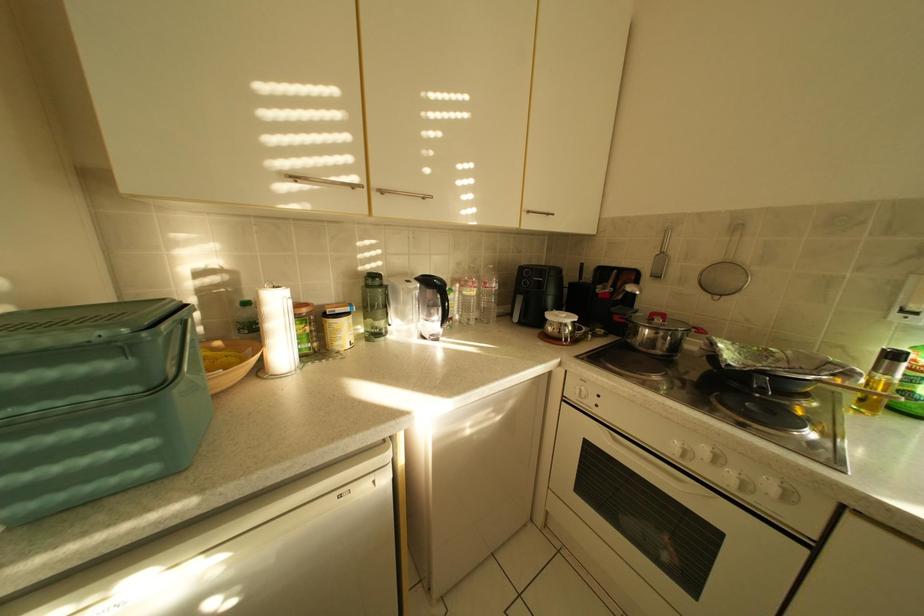
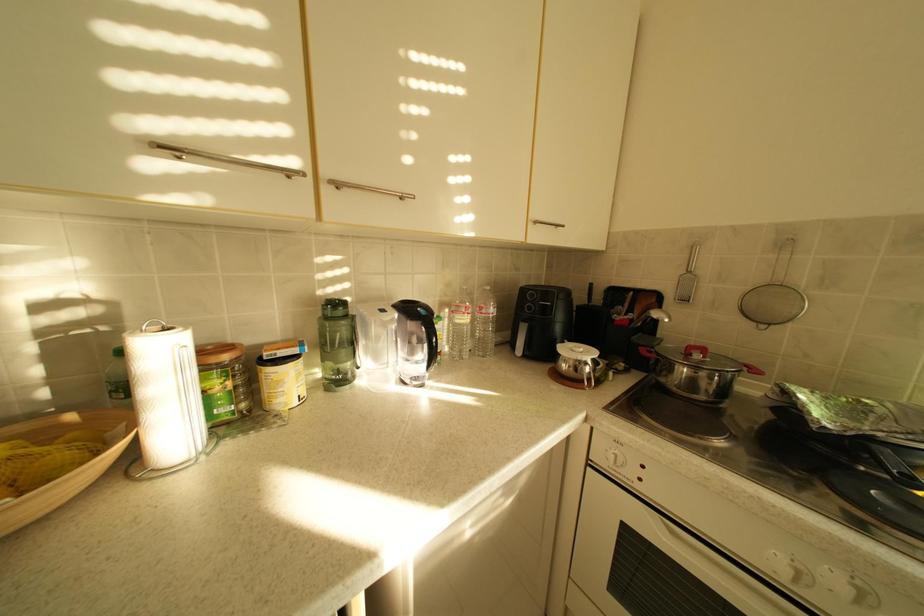
Question: Based on the continuous images, in which direction is the camera rotating? Reply with the corresponding letter.

Choices:
 (A) Left
 (B) Right
 (C) Up
 (D) Down

Answer: (B)